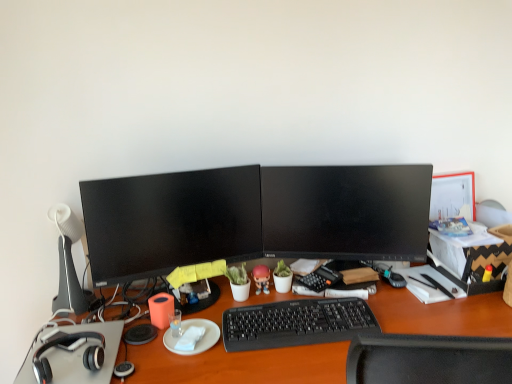
Question: From a real-world perspective, is white plastic table lamp at left positioned under orange matte tissue at center based on gravity?

Choices:
 (A) no
 (B) yes

Answer: (A)

Question: Is white plastic table lamp at left oriented towards orange matte tissue at center?

Choices:
 (A) yes
 (B) no

Answer: (B)

Question: Is white plastic table lamp at left oriented away from orange matte tissue at center?

Choices:
 (A) no
 (B) yes

Answer: (A)

Question: Does white plastic table lamp at left have a larger size compared to orange matte tissue at center?

Choices:
 (A) yes
 (B) no

Answer: (A)

Question: From the image's perspective, does white plastic table lamp at left appear lower than orange matte tissue at center?

Choices:
 (A) no
 (B) yes

Answer: (A)

Question: Does white plastic table lamp at left have a lesser width compared to orange matte tissue at center?

Choices:
 (A) yes
 (B) no

Answer: (B)

Question: Is black plastic keyboard at center beside black glossy monitor at center, arranged as the 1th computer monitor when viewed from the right?

Choices:
 (A) no
 (B) yes

Answer: (A)

Question: Does black plastic keyboard at center appear on the left side of black glossy monitor at center, the 2th computer monitor in the left-to-right sequence?

Choices:
 (A) yes
 (B) no

Answer: (A)

Question: Considering the relative sizes of black plastic keyboard at center and black glossy monitor at center, arranged as the 1th computer monitor when viewed from the right, in the image provided, is black plastic keyboard at center thinner than black glossy monitor at center, arranged as the 1th computer monitor when viewed from the right,?

Choices:
 (A) yes
 (B) no

Answer: (B)

Question: Considering the relative sizes of black plastic keyboard at center and black glossy monitor at center, arranged as the 1th computer monitor when viewed from the right, in the image provided, is black plastic keyboard at center taller than black glossy monitor at center, arranged as the 1th computer monitor when viewed from the right,?

Choices:
 (A) no
 (B) yes

Answer: (A)

Question: Would you say black plastic keyboard at center is outside black glossy monitor at center, the 2th computer monitor in the left-to-right sequence?

Choices:
 (A) yes
 (B) no

Answer: (A)

Question: From the image's perspective, is black plastic keyboard at center over black glossy monitor at center, arranged as the 1th computer monitor when viewed from the right?

Choices:
 (A) no
 (B) yes

Answer: (A)

Question: Is black plastic keyboard at center wider than matte black monitor at center, which is the first computer monitor in left-to-right order?

Choices:
 (A) yes
 (B) no

Answer: (A)